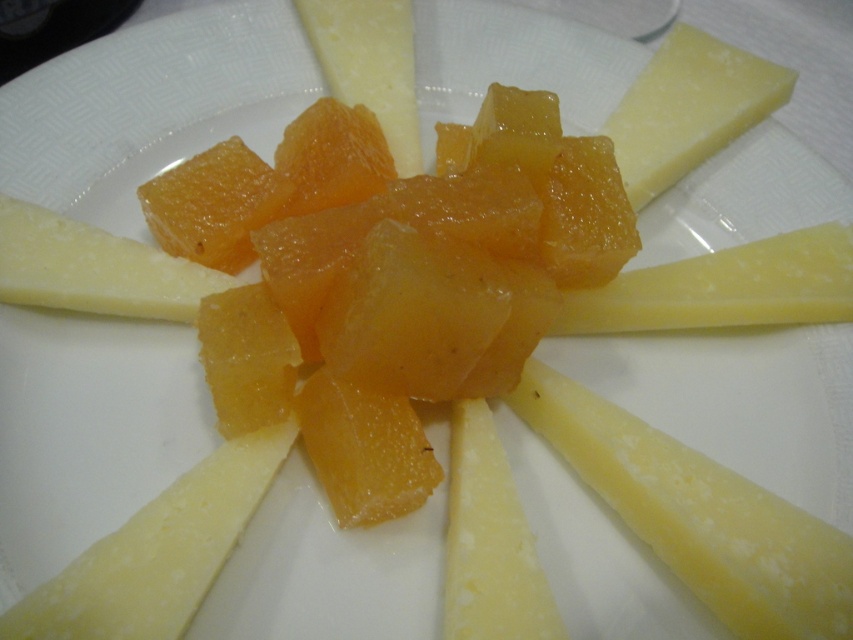
Is yellow creamy cheese at lower right bigger than hard yellow cheese at upper right?

Yes.

Is yellow creamy cheese at lower right taller than hard yellow cheese at upper right?

No.

Which is in front, point (763, 620) or point (726, 109)?

Point (763, 620)

The height and width of the screenshot is (640, 853). I want to click on yellow creamy cheese at lower right, so click(x=698, y=515).

Which of these two, yellow semi-hard cheese at center or yellow smooth cheese at lower right, stands taller?

With more height is yellow smooth cheese at lower right.

Is point (724, 300) more distant than point (468, 576)?

Yes, it is.

Image resolution: width=853 pixels, height=640 pixels. I want to click on yellow semi-hard cheese at center, so click(724, 289).

Between yellow creamy cheese at center and yellow smooth cheese at lower right, which one appears on the right side from the viewer's perspective?

yellow smooth cheese at lower right

Describe the element at coordinates (157, 552) in the screenshot. I see `yellow creamy cheese at center` at that location.

You are a GUI agent. You are given a task and a screenshot of the screen. Output one action in this format:
    pyautogui.click(x=<x>, y=<y>)
    Task: Click on the yellow creamy cheese at center
    The width and height of the screenshot is (853, 640).
    Given the screenshot: What is the action you would take?
    pyautogui.click(x=157, y=552)